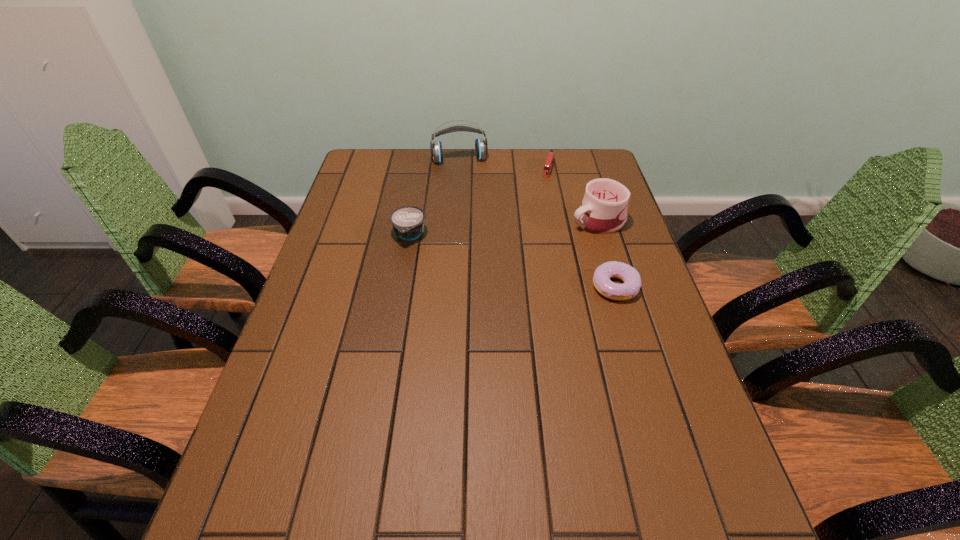
Locate an element on the screen. vacant space located 0.360m on the side with the handle of the fourth shortest object is located at coordinates (464, 258).

This screenshot has width=960, height=540. Identify the location of free spot located on the side with the handle of the fourth shortest object. (496, 248).

The image size is (960, 540). I want to click on vacant space located 0.290m on the side with the handle of the fourth shortest object, so click(x=487, y=251).

Identify the location of free location located 0.230m on the front-facing side of the stapler. (536, 216).

At what (x,y) coordinates should I click in order to perform the action: click on vacant space located on the front-facing side of the stapler. Please return your answer as a coordinate pair (x, y). Looking at the image, I should click on pos(531,234).

Identify the location of vacant space situated 0.070m on the front-facing side of the stapler. (545, 188).

What are the coordinates of `headset positioned at the far edge` in the screenshot? It's located at (481, 148).

This screenshot has width=960, height=540. What are the coordinates of `stapler located in the far edge section of the desktop` in the screenshot? It's located at (550, 159).

Image resolution: width=960 pixels, height=540 pixels. What are the coordinates of `doughnut that is at the right edge` in the screenshot? It's located at (630, 288).

Where is `mug at the right edge`? mug at the right edge is located at coordinates (603, 210).